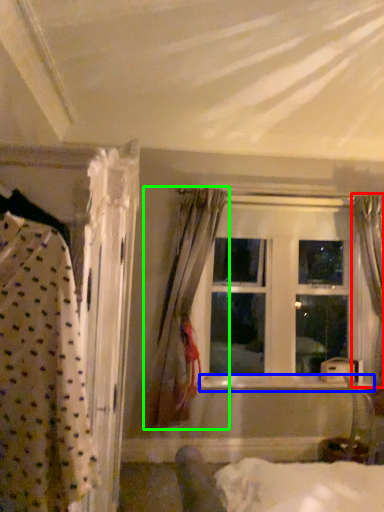
Question: Considering the real-world distances, which object is closest to curtain (highlighted by a red box)? window sill (highlighted by a blue box) or curtain (highlighted by a green box).

Choices:
 (A) window sill
 (B) curtain

Answer: (A)